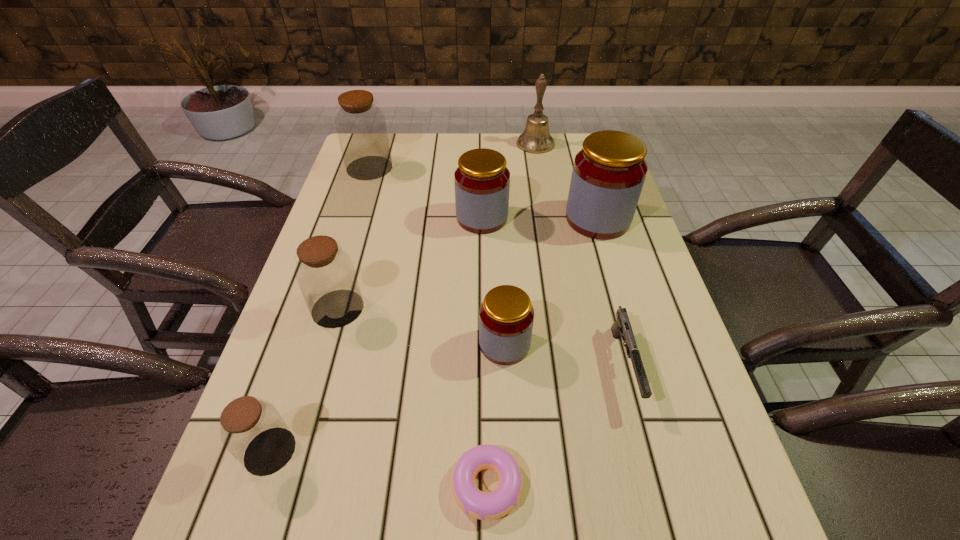
The image size is (960, 540). I want to click on the eighth tallest object, so click(x=622, y=327).

Where is `gun`? gun is located at coordinates (622, 327).

This screenshot has width=960, height=540. What are the coordinates of `the shortest object` in the screenshot? It's located at click(x=484, y=506).

The height and width of the screenshot is (540, 960). I want to click on vacant region located on the front of the farthest object, so click(x=546, y=208).

I want to click on vacant region located on the front of the farthest jar, so click(349, 230).

The width and height of the screenshot is (960, 540). What are the coordinates of `vacant space located 0.160m on the left of the biggest red jar` in the screenshot? It's located at (506, 219).

This screenshot has width=960, height=540. What are the coordinates of `free spot located 0.060m on the front of the second biggest brown jar` in the screenshot? It's located at (324, 353).

This screenshot has height=540, width=960. I want to click on vacant area located on the left of the second smallest red jar, so click(x=327, y=218).

The image size is (960, 540). Identify the location of vacant space located 0.130m on the right of the nearest red jar. (593, 344).

Image resolution: width=960 pixels, height=540 pixels. Identify the location of free space located on the back of the smallest brown jar. (309, 333).